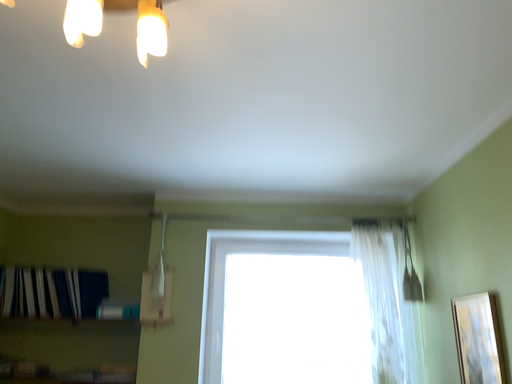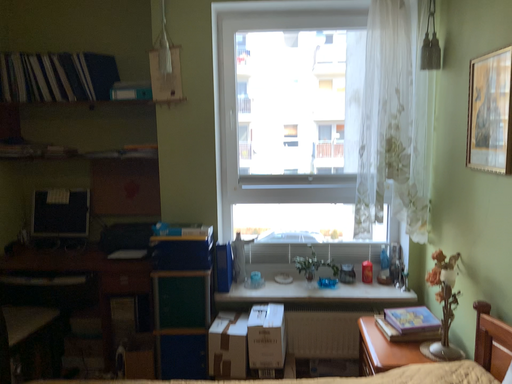
Question: Which way did the camera rotate in the video?

Choices:
 (A) rotated upward
 (B) rotated downward

Answer: (B)